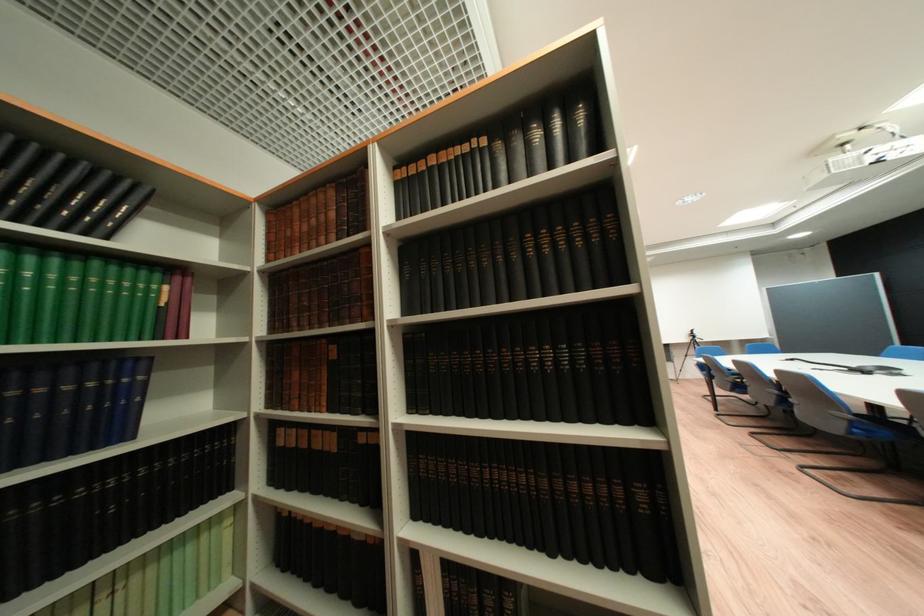
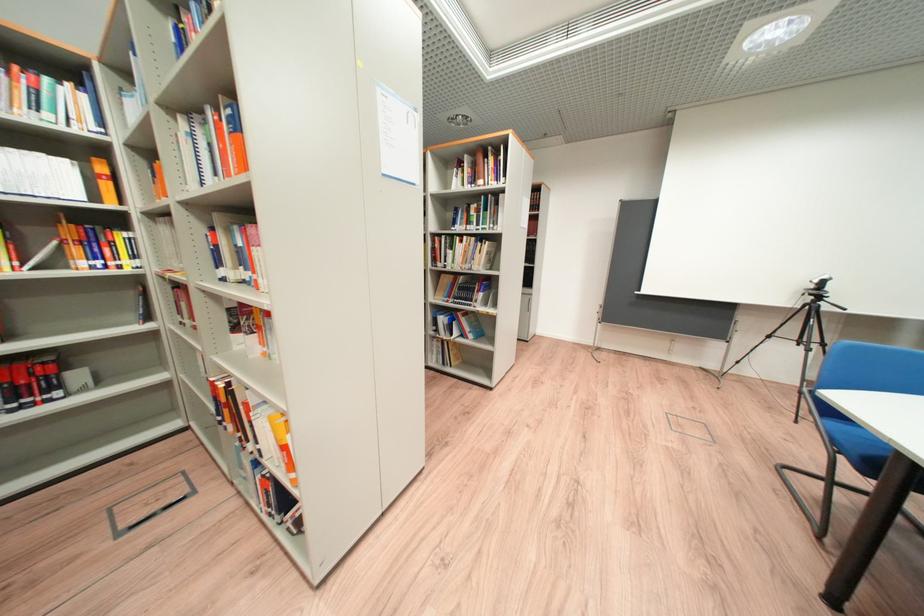
What movement of the cameraman would produce the second image?

The movement direction of the cameraman is right, forward.